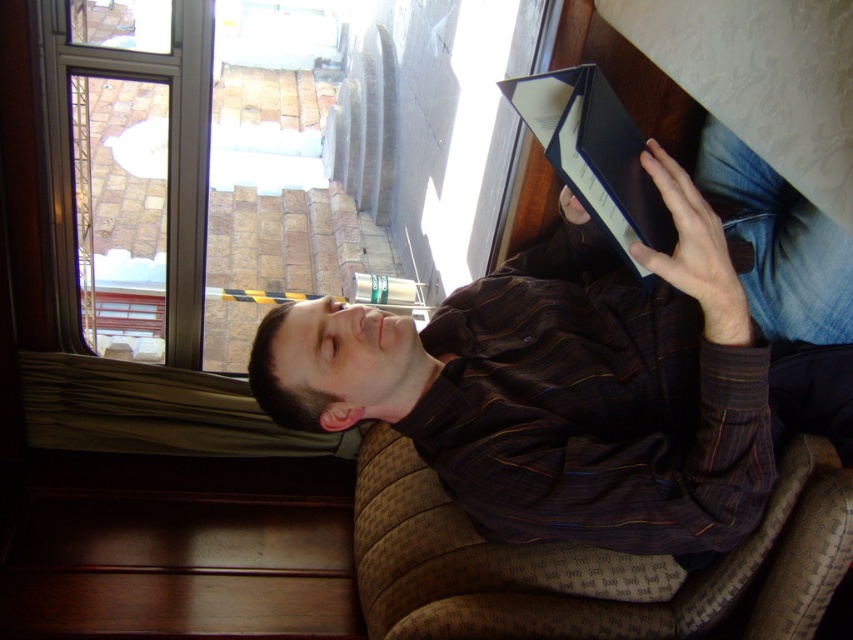
Between brown striped shirt at center and clear glass window at upper left, which one is positioned higher?

clear glass window at upper left

Between brown striped shirt at center and clear glass window at upper left, which one has more height?

clear glass window at upper left is taller.

Between point (784, 426) and point (457, 3), which one is positioned in front?

Point (784, 426)

Find the location of `brown striped shirt at center`. brown striped shirt at center is located at coordinates (x=602, y=368).

Does clear glass window at upper left have a lesser height compared to brown striped shirt at upper center?

In fact, clear glass window at upper left may be taller than brown striped shirt at upper center.

This screenshot has width=853, height=640. Describe the element at coordinates (263, 209) in the screenshot. I see `clear glass window at upper left` at that location.

Is point (155, 26) positioned in front of point (302, 340)?

No, (155, 26) is further to viewer.

The image size is (853, 640). Find the location of `clear glass window at upper left`. clear glass window at upper left is located at coordinates (263, 209).

Between brown striped shirt at center and brown striped shirt at upper center, which one has less height?

Standing shorter between the two is brown striped shirt at upper center.

Is point (537, 289) farther from viewer compared to point (280, 388)?

That is True.

This screenshot has height=640, width=853. Describe the element at coordinates (602, 368) in the screenshot. I see `brown striped shirt at center` at that location.

Where is `brown striped shirt at center`? The height and width of the screenshot is (640, 853). brown striped shirt at center is located at coordinates (602, 368).